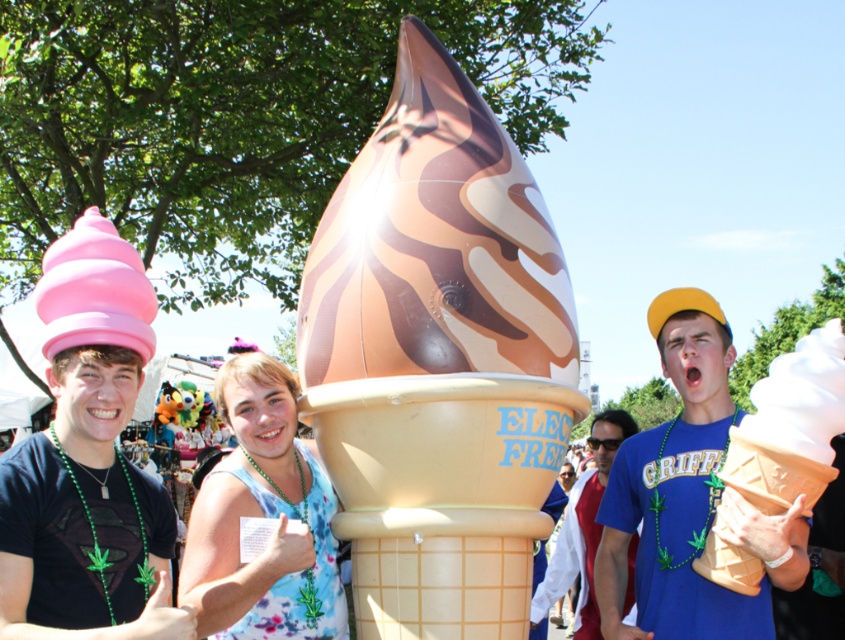
Who is shorter, pink matte ice cream cone at left or blue fabric shirt at center?

pink matte ice cream cone at left

Between point (129, 273) and point (633, 426), which one is positioned in front?

Point (129, 273) is in front.

What are the coordinates of `pink matte ice cream cone at left` in the screenshot? It's located at (88, 460).

At what (x,y) coordinates should I click in order to perform the action: click on pink matte ice cream cone at left. Please return your answer as a coordinate pair (x, y). Looking at the image, I should click on (88, 460).

Who is positioned more to the right, pink matte ice cream cone at left or white matte ice cream cone at right?

Positioned to the right is white matte ice cream cone at right.

Which of these two, pink matte ice cream cone at left or white matte ice cream cone at right, stands taller?

white matte ice cream cone at right

Locate an element on the screen. pink matte ice cream cone at left is located at coordinates (88, 460).

Which is more to the right, matte blue t-shirt at center or blue fabric shirt at center?

matte blue t-shirt at center

Is point (668, 564) positioned before point (598, 614)?

Yes, point (668, 564) is closer to viewer.

The width and height of the screenshot is (845, 640). What do you see at coordinates (688, 497) in the screenshot?
I see `matte blue t-shirt at center` at bounding box center [688, 497].

This screenshot has width=845, height=640. What are the coordinates of `matte blue t-shirt at center` in the screenshot? It's located at (688, 497).